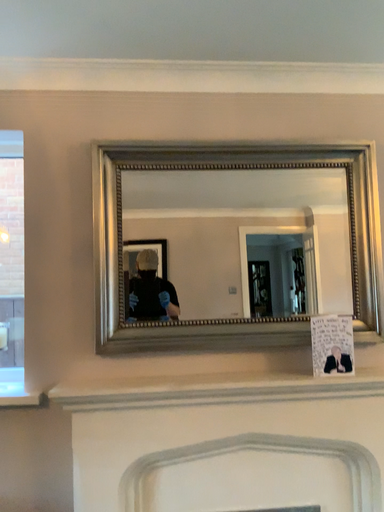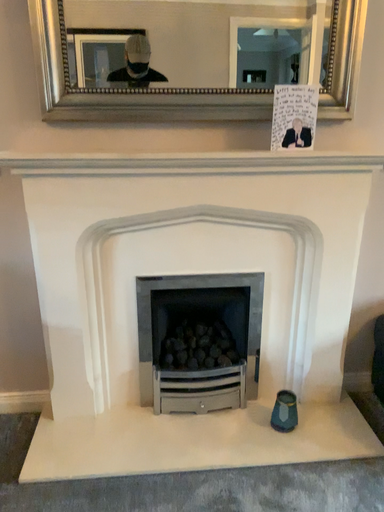
Question: How did the camera likely rotate when shooting the video?

Choices:
 (A) rotated upward
 (B) rotated downward

Answer: (B)